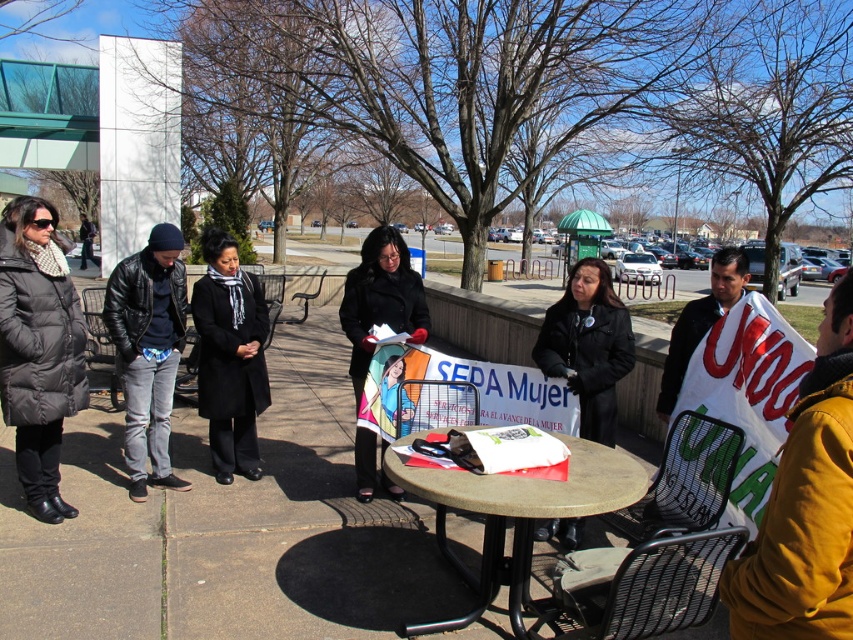
Does concrete table at center have a lesser width compared to white cotton shirt at center?

Yes, concrete table at center is thinner than white cotton shirt at center.

Between concrete table at center and white cotton shirt at center, which one has more height?

white cotton shirt at center is taller.

This screenshot has width=853, height=640. What do you see at coordinates (515, 515) in the screenshot?
I see `concrete table at center` at bounding box center [515, 515].

At what (x,y) coordinates should I click in order to perform the action: click on concrete table at center. Please return your answer as a coordinate pair (x, y). Looking at the image, I should click on (515, 515).

Is concrete table at center shorter than leather jacket at center?

Yes, concrete table at center is shorter than leather jacket at center.

Which is above, concrete table at center or leather jacket at center?

leather jacket at center is above.

Where is `concrete table at center`? This screenshot has height=640, width=853. concrete table at center is located at coordinates (515, 515).

Between leather jacket at center and black matte coat at center, which one is positioned lower?

Positioned lower is black matte coat at center.

Can you confirm if leather jacket at center is positioned to the left of black matte coat at center?

Correct, you'll find leather jacket at center to the left of black matte coat at center.

Is point (138, 480) in front of point (373, 476)?

Yes, it is in front of point (373, 476).

Image resolution: width=853 pixels, height=640 pixels. Find the location of `leather jacket at center`. leather jacket at center is located at coordinates (148, 352).